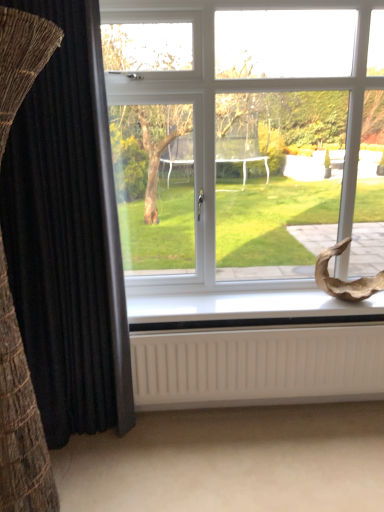
Locate an element on the screen. The height and width of the screenshot is (512, 384). free point above white plastic window sill at lower center (from a real-world perspective) is located at coordinates (251, 303).